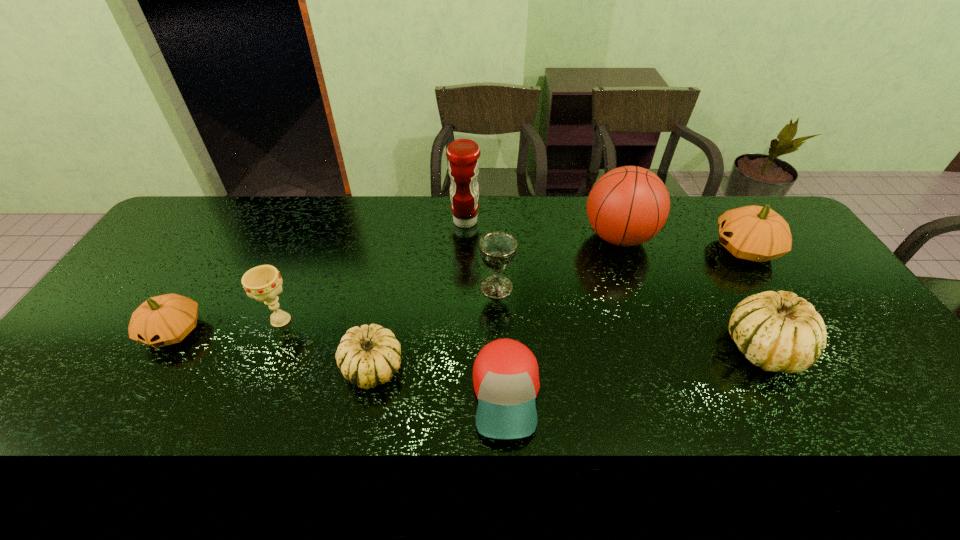
Locate an element on the screen. free space that satisfies the following two spatial constraints: 1. on the side of the right orange gourd with the carved face; 2. at the brim of the baseball cap is located at coordinates (838, 395).

At what (x,y) coordinates should I click in order to perform the action: click on free space that satisfies the following two spatial constraints: 1. on the side of the smaller white gourd with the carved face; 2. on the left side of the left orange gourd. Please return your answer as a coordinate pair (x, y). The height and width of the screenshot is (540, 960). Looking at the image, I should click on (152, 368).

This screenshot has width=960, height=540. Identify the location of free space that satisfies the following two spatial constraints: 1. on the side of the farthest gourd with the carved face; 2. at the brim of the red baseball cap. [x=838, y=395].